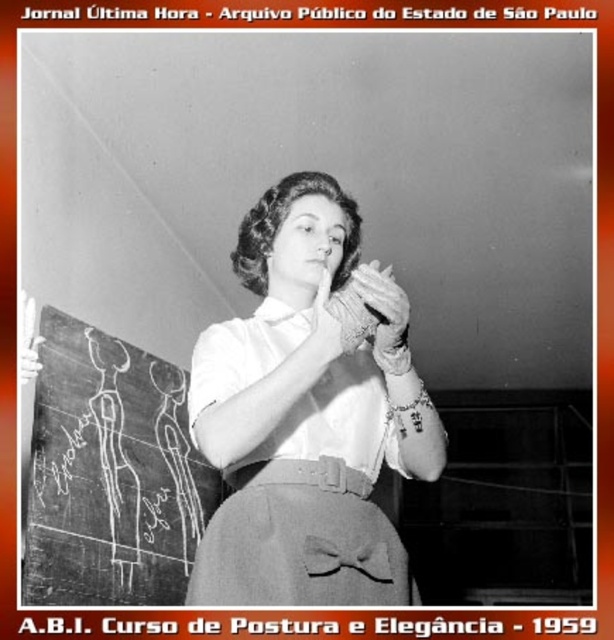
Question: Which point is closer to the camera?

Choices:
 (A) (230, 563)
 (B) (578, 632)

Answer: (A)

Question: Does white chalkboard at upper left have a greater width compared to black chalkboard at upper left?

Choices:
 (A) yes
 (B) no

Answer: (A)

Question: Which point appears closest to the camera in this image?

Choices:
 (A) (187, 628)
 (B) (176, 19)

Answer: (A)

Question: Can you confirm if chalkboard at left is positioned to the left of black chalkboard at upper left?

Choices:
 (A) yes
 (B) no

Answer: (A)

Question: Among these objects, which one is farthest from the camera?

Choices:
 (A) white satin blouse at center
 (B) matte gray apron at center
 (C) black chalkboard at upper left
 (D) chalkboard at left

Answer: (C)

Question: Is chalkboard at left positioned in front of matte gray apron at center?

Choices:
 (A) yes
 (B) no

Answer: (B)